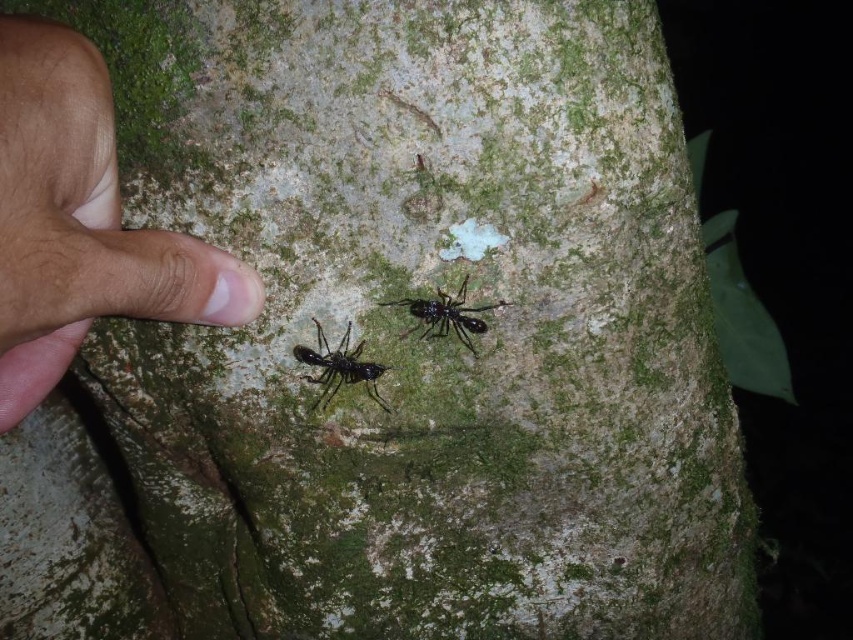
In the scene shown: You are a biologist observing the tree trunk. You notice the brown skin at left and the black glossy ant at lower left. Which object is bigger in size?

The brown skin at left is larger in size than the black glossy ant at lower left.

You are an entomologist examining the tree trunk and notice two black glossy ants. Which one has a wider body, the black glossy ant at lower left or the black glossy ant at center?

The black glossy ant at center has a wider body since the black glossy ant at lower left is thinner than it.